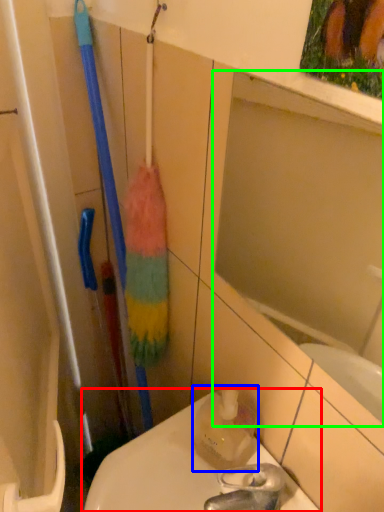
Question: Estimate the real-world distances between objects in this image. Which object is closer to toilet (highlighted by a red box), cleaning product (highlighted by a blue box) or mirror (highlighted by a green box)?

Choices:
 (A) cleaning product
 (B) mirror

Answer: (A)